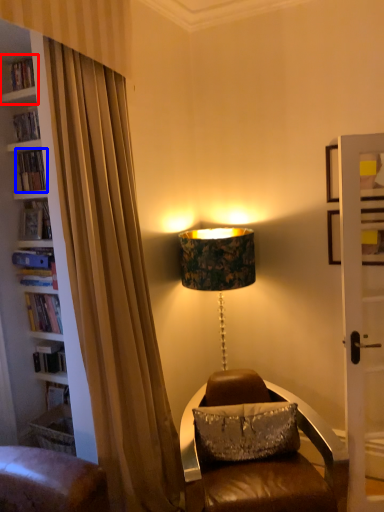
Question: Among these objects, which one is farthest to the camera, shelf (highlighted by a red box) or book (highlighted by a blue box)?

Choices:
 (A) shelf
 (B) book

Answer: (B)